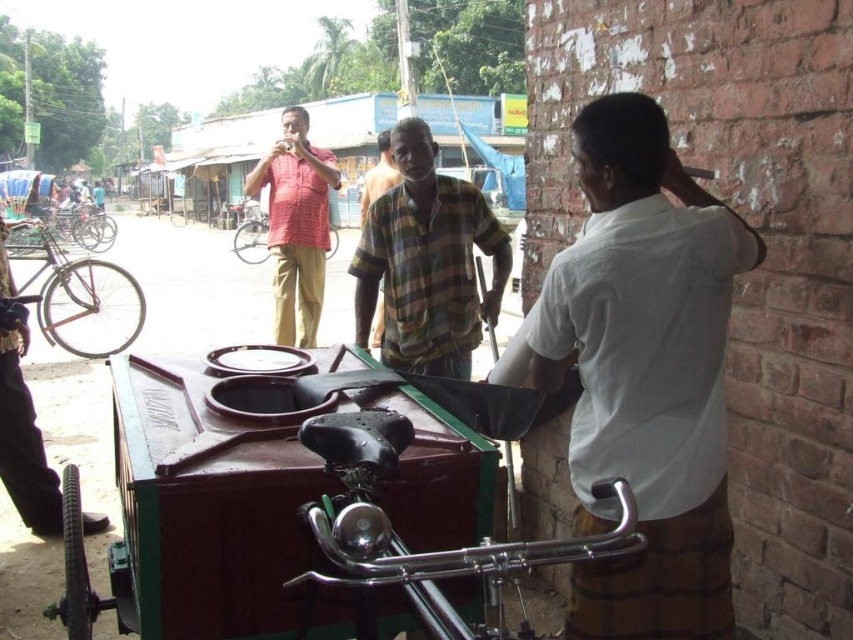
Which is below, wooden cart at center or plaid cotton shirt at center?

wooden cart at center

Can you confirm if wooden cart at center is shorter than plaid cotton shirt at center?

Correct, wooden cart at center is not as tall as plaid cotton shirt at center.

Is point (252, 620) positioned behind point (408, 362)?

No.

Locate an element on the screen. This screenshot has height=640, width=853. wooden cart at center is located at coordinates (305, 518).

Can you confirm if wooden cart at center is positioned to the left of checkered fabric shirt at center?

No, wooden cart at center is not to the left of checkered fabric shirt at center.

Is point (332, 490) positioned after point (378, 132)?

That is False.

Is point (486, 561) closer to viewer compared to point (399, 179)?

Yes.

I want to click on wooden cart at center, so click(305, 518).

Is white cotton shirt at right smaller than checkered fabric shirt at center?

Correct, white cotton shirt at right occupies less space than checkered fabric shirt at center.

Who is more forward, (689, 211) or (384, 172)?

Positioned in front is point (689, 211).

Identify the location of white cotton shirt at right. This screenshot has height=640, width=853. (642, 374).